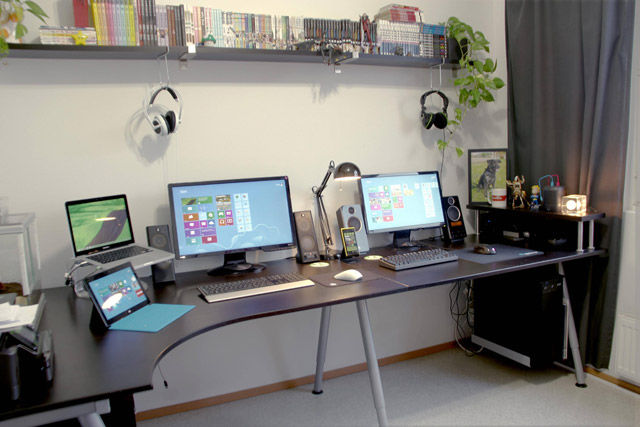
At what (x,y) coordinates should I click in order to perform the action: click on curtain. Please return your answer as a coordinate pair (x, y). The width and height of the screenshot is (640, 427). Looking at the image, I should click on (589, 119).